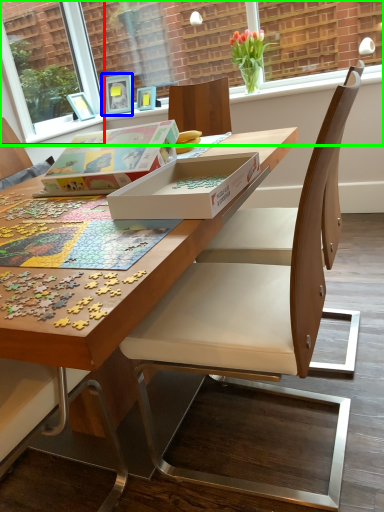
Question: Which is nearer to the window screen (highlighted by a red box)? picture frame (highlighted by a blue box) or window screen (highlighted by a green box).

Choices:
 (A) picture frame
 (B) window screen

Answer: (A)